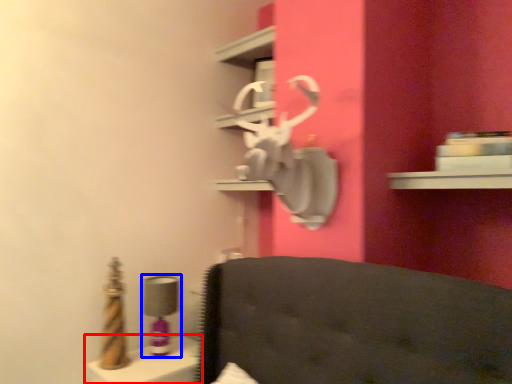
Question: Among these objects, which one is farthest to the camera, vanity (highlighted by a red box) or table lamp (highlighted by a blue box)?

Choices:
 (A) vanity
 (B) table lamp

Answer: (B)